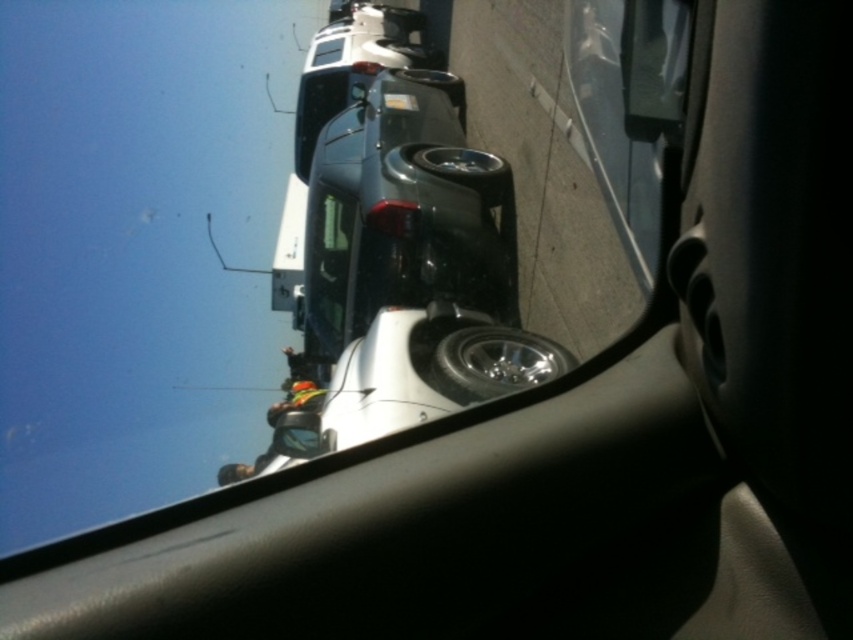
Question: Is glossy black car at center thinner than glossy plastic car mirror at upper center?

Choices:
 (A) yes
 (B) no

Answer: (B)

Question: Which point is farther from the camera taking this photo?

Choices:
 (A) [x=483, y=216]
 (B) [x=393, y=97]
 (C) [x=675, y=1]

Answer: (B)

Question: Estimate the real-world distances between objects in this image. Which object is farther from the glossy black car at center?

Choices:
 (A) glossy plastic car mirror at upper center
 (B) white plastic license plate at upper center

Answer: (A)

Question: Does glossy plastic car mirror at upper center have a greater width compared to white plastic license plate at upper center?

Choices:
 (A) no
 (B) yes

Answer: (A)

Question: From the image, what is the correct spatial relationship of glossy plastic car mirror at upper center in relation to white plastic license plate at upper center?

Choices:
 (A) above
 (B) below

Answer: (B)

Question: Which object appears closest to the camera in this image?

Choices:
 (A) glossy black car at center
 (B) white plastic license plate at upper center
 (C) glossy plastic car mirror at upper center

Answer: (C)